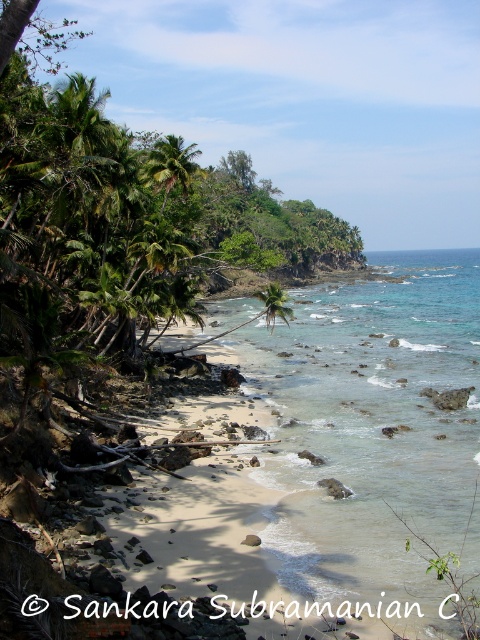
Question: Which point appears farthest from the camera in this image?

Choices:
 (A) (264, 316)
 (B) (164, 192)
 (C) (444, 429)

Answer: (A)

Question: Is clear water at beach center to the right of green leafy palm tree at upper left from the viewer's perspective?

Choices:
 (A) yes
 (B) no

Answer: (A)

Question: In this image, where is clear water at beach center located relative to green leafy palm tree at center?

Choices:
 (A) above
 (B) below

Answer: (B)

Question: In this image, where is clear water at beach center located relative to green leafy palm tree at upper left?

Choices:
 (A) below
 (B) above

Answer: (A)

Question: Which object appears farthest from the camera in this image?

Choices:
 (A) green leafy palm tree at upper left
 (B) clear water at beach center
 (C) green leafy palm tree at center

Answer: (C)

Question: Which point is closer to the camera?

Choices:
 (A) (266, 285)
 (B) (159, 164)

Answer: (B)